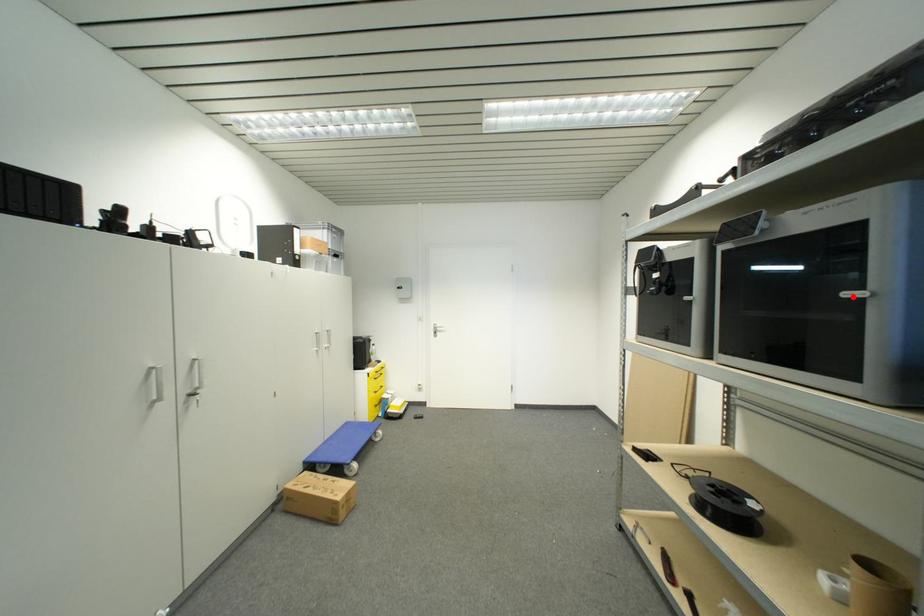
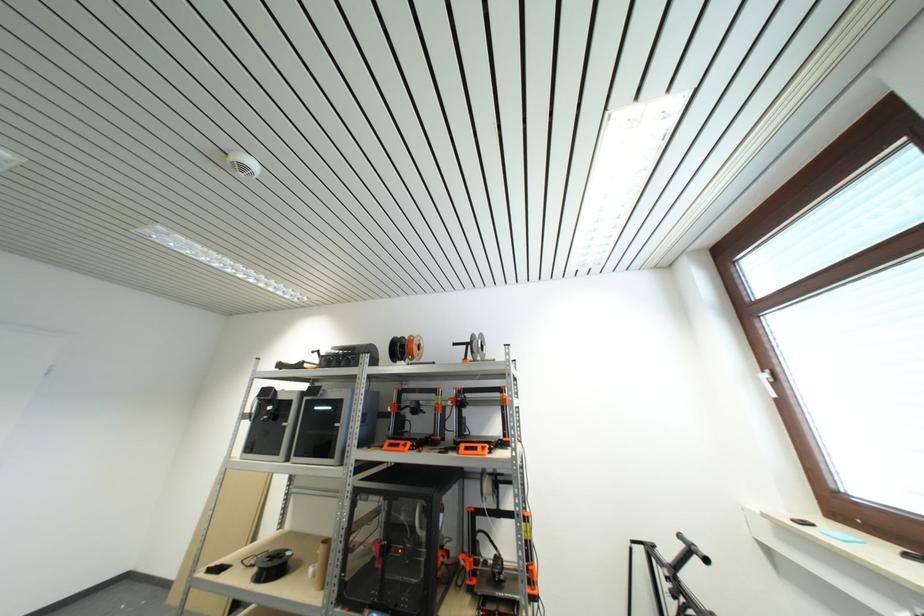
Locate, in the second image, the point that corresponds to the highlighted location in the first image.

(341, 427)